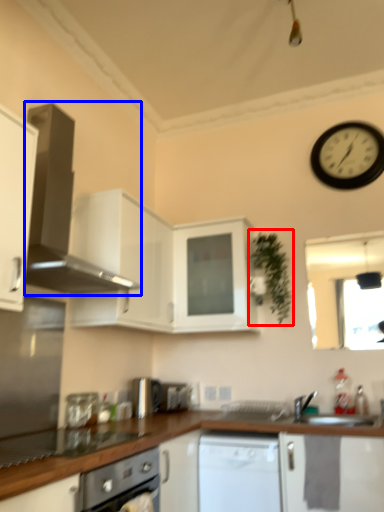
Question: Which object appears closest to the camera in this image, plant (highlighted by a red box) or home appliance (highlighted by a blue box)?

Choices:
 (A) plant
 (B) home appliance

Answer: (B)